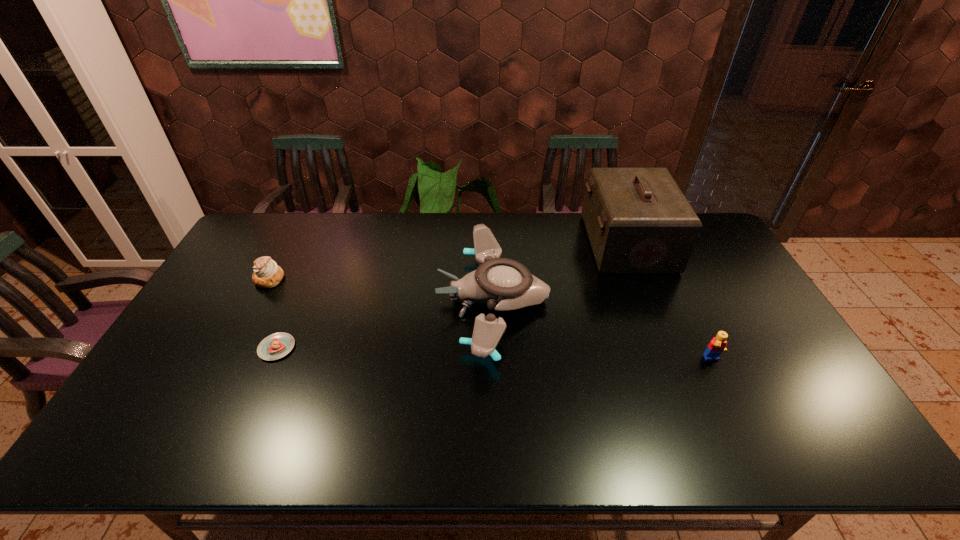
Select which object appears as the closest to the fourth object from right to left. Please provide its 2D coordinates. Your answer should be formatted as a tuple, i.e. [(x, y)], where the tuple contains the x and y coordinates of a point satisfying the conditions above.

[(267, 274)]

Point out which object is positioned as the second nearest to the first-aid kit. Please provide its 2D coordinates. Your answer should be formatted as a tuple, i.e. [(x, y)], where the tuple contains the x and y coordinates of a point satisfying the conditions above.

[(717, 345)]

Locate an element on the screen. free spot that satisfies the following two spatial constraints: 1. on the back side of the first-aid kit; 2. on the left side of the right pastry is located at coordinates (322, 244).